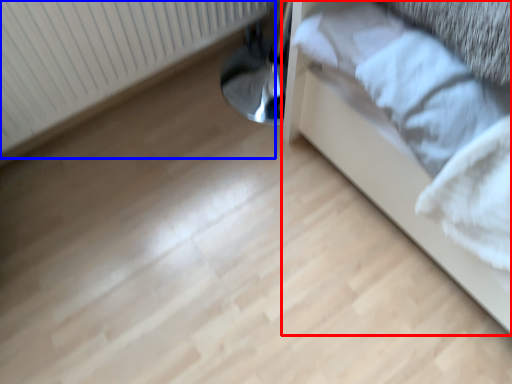
Question: Which of the following is the farthest to the observer, furniture (highlighted by a red box) or radiator (highlighted by a blue box)?

Choices:
 (A) furniture
 (B) radiator

Answer: (B)